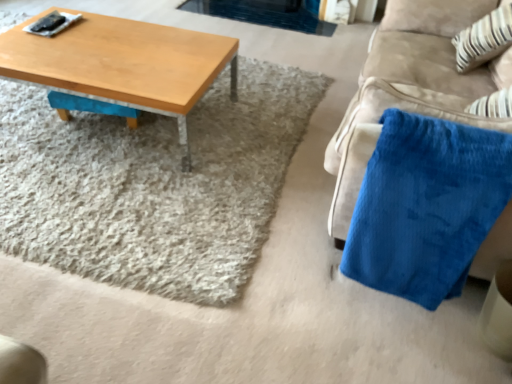
At what (x,y) coordinates should I click in order to perform the action: click on white striped fabric at upper right. Please return your answer as a coordinate pair (x, y). This screenshot has height=384, width=512. Looking at the image, I should click on (484, 39).

What do you see at coordinates (122, 64) in the screenshot? The height and width of the screenshot is (384, 512). I see `light brown wood coffee table at upper left` at bounding box center [122, 64].

In order to face velvety blue blanket at right, should I rotate leftwards or rightwards?

Rotate your view right by about 25.039°.

What do you see at coordinates (410, 88) in the screenshot? I see `velvety blue blanket at right` at bounding box center [410, 88].

Identify the location of white striped fabric at upper right. (484, 39).

Which object is thinner, light brown wood coffee table at upper left or white striped fabric at upper right?

white striped fabric at upper right is thinner.

Is light brown wood coffee table at upper left smaller than white striped fabric at upper right?

Actually, light brown wood coffee table at upper left might be larger than white striped fabric at upper right.

Is the surface of light brown wood coffee table at upper left in direct contact with white striped fabric at upper right?

No.

Considering the relative sizes of light brown wood coffee table at upper left and white striped fabric at upper right in the image provided, is light brown wood coffee table at upper left shorter than white striped fabric at upper right?

Yes, light brown wood coffee table at upper left is shorter than white striped fabric at upper right.

Considering the sizes of objects white striped fabric at upper right and light brown wood coffee table at upper left in the image provided, who is shorter, white striped fabric at upper right or light brown wood coffee table at upper left?

Standing shorter between the two is light brown wood coffee table at upper left.

Which is farther from the camera, (492, 14) or (94, 34)?

Result: The point (94, 34) is farther.

The height and width of the screenshot is (384, 512). Identify the location of coffee table below the white striped fabric at upper right (from the image's perspective). (122, 64).

From a real-world perspective, which object stands above the other?

white striped fabric at upper right is physically above.

From the image's perspective, who appears lower, light brown wood coffee table at upper left or velvety blue blanket at right?

From the image's view, velvety blue blanket at right is below.

Is light brown wood coffee table at upper left placed right next to velvety blue blanket at right?

No, light brown wood coffee table at upper left is not touching velvety blue blanket at right.

I want to click on coffee table on the left of velvety blue blanket at right, so click(122, 64).

Who is taller, white striped fabric at upper right or velvety blue blanket at right?

Standing taller between the two is velvety blue blanket at right.

Considering the relative positions of white striped fabric at upper right and velvety blue blanket at right in the image provided, is white striped fabric at upper right to the left or to the right of velvety blue blanket at right?

white striped fabric at upper right is to the right of velvety blue blanket at right.

From the image's perspective, is white striped fabric at upper right on velvety blue blanket at right?

Yes.

Considering the sizes of objects white striped fabric at upper right and velvety blue blanket at right in the image provided, who is smaller, white striped fabric at upper right or velvety blue blanket at right?

With smaller size is white striped fabric at upper right.

Is velvety blue blanket at right not close to light brown wood coffee table at upper left?

Indeed, velvety blue blanket at right is not near light brown wood coffee table at upper left.

Which is in front, point (503, 257) or point (68, 70)?

Positioned in front is point (503, 257).

Which of these two, velvety blue blanket at right or light brown wood coffee table at upper left, is bigger?

velvety blue blanket at right is bigger.

Is velvety blue blanket at right behind light brown wood coffee table at upper left?

No, velvety blue blanket at right is closer to the viewer.

How many degrees apart are the facing directions of velvety blue blanket at right and white striped fabric at upper right?

There is a 0.749-degree angle between the facing directions of velvety blue blanket at right and white striped fabric at upper right.

Is velvety blue blanket at right thinner than white striped fabric at upper right?

No.

Is velvety blue blanket at right aimed at white striped fabric at upper right?

Yes, velvety blue blanket at right is facing white striped fabric at upper right.

Is velvety blue blanket at right in contact with white striped fabric at upper right?

velvety blue blanket at right is not next to white striped fabric at upper right, and they're not touching.

This screenshot has height=384, width=512. What are the coordinates of `throw pillow above the light brown wood coffee table at upper left (from the image's perspective)` in the screenshot? It's located at (484, 39).

The height and width of the screenshot is (384, 512). I want to click on coffee table in front of the white striped fabric at upper right, so click(122, 64).

Considering their positions, is velvety blue blanket at right positioned closer to white striped fabric at upper right than light brown wood coffee table at upper left?

The object closer to white striped fabric at upper right is velvety blue blanket at right.

In the scene shown: Estimate the real-world distances between objects in this image. Which object is further from velvety blue blanket at right, light brown wood coffee table at upper left or white striped fabric at upper right?

light brown wood coffee table at upper left is positioned further to the anchor velvety blue blanket at right.

From the picture: Based on their spatial positions, is white striped fabric at upper right or light brown wood coffee table at upper left closer to velvety blue blanket at right?

The object closer to velvety blue blanket at right is white striped fabric at upper right.

Based on their spatial positions, is light brown wood coffee table at upper left or velvety blue blanket at right further from white striped fabric at upper right?

Based on the image, light brown wood coffee table at upper left appears to be further to white striped fabric at upper right.

Looking at the image, which one is located closer to light brown wood coffee table at upper left, velvety blue blanket at right or white striped fabric at upper right?

velvety blue blanket at right lies closer to light brown wood coffee table at upper left than the other object.

In the scene shown: From the image, which object appears to be farther from light brown wood coffee table at upper left, white striped fabric at upper right or velvety blue blanket at right?

white striped fabric at upper right.

This screenshot has height=384, width=512. Identify the location of studio couch between light brown wood coffee table at upper left and white striped fabric at upper right. (410, 88).